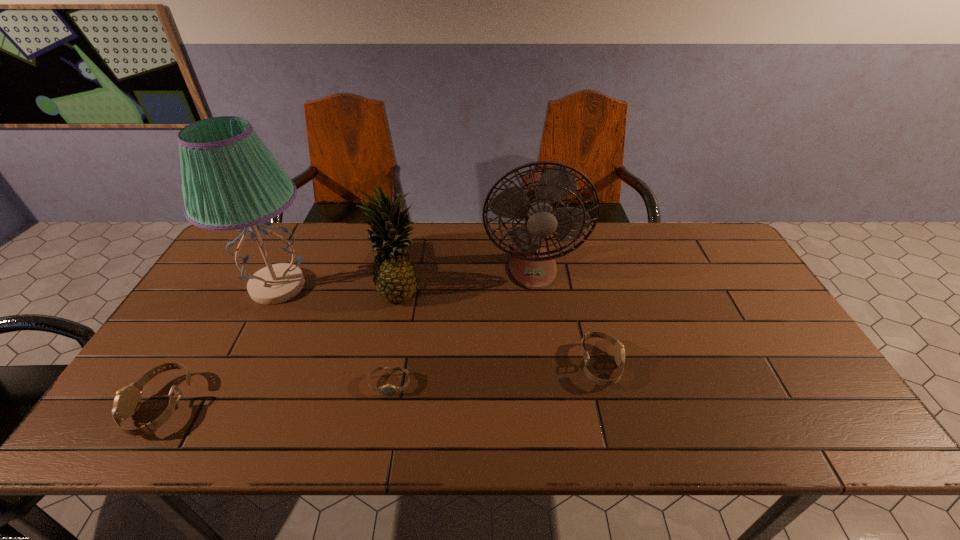
Image resolution: width=960 pixels, height=540 pixels. Identify the location of free space between the rightmost watch and the leftmost watch. (380, 386).

Locate which object ranks third in proximity to the second watch from left to right. Please provide its 2D coordinates. Your answer should be formatted as a tuple, i.e. [(x, y)], where the tuple contains the x and y coordinates of a point satisfying the conditions above.

[(531, 265)]

Where is `object that is the fourth closest one to the leftmost watch`? The height and width of the screenshot is (540, 960). object that is the fourth closest one to the leftmost watch is located at coordinates (531, 265).

Find the location of `the closest watch to the fan`. the closest watch to the fan is located at coordinates (619, 352).

Where is `watch that is the second closest to the fan`? This screenshot has width=960, height=540. watch that is the second closest to the fan is located at coordinates (389, 390).

The height and width of the screenshot is (540, 960). I want to click on vacant point that satisfies the following two spatial constraints: 1. in front of the fan to direct airflow; 2. on the face of the leftmost watch, so click(551, 406).

The image size is (960, 540). Identify the location of vacant space that satisfies the following two spatial constraints: 1. in front of the fan to direct airflow; 2. on the face of the leftmost watch. (551, 406).